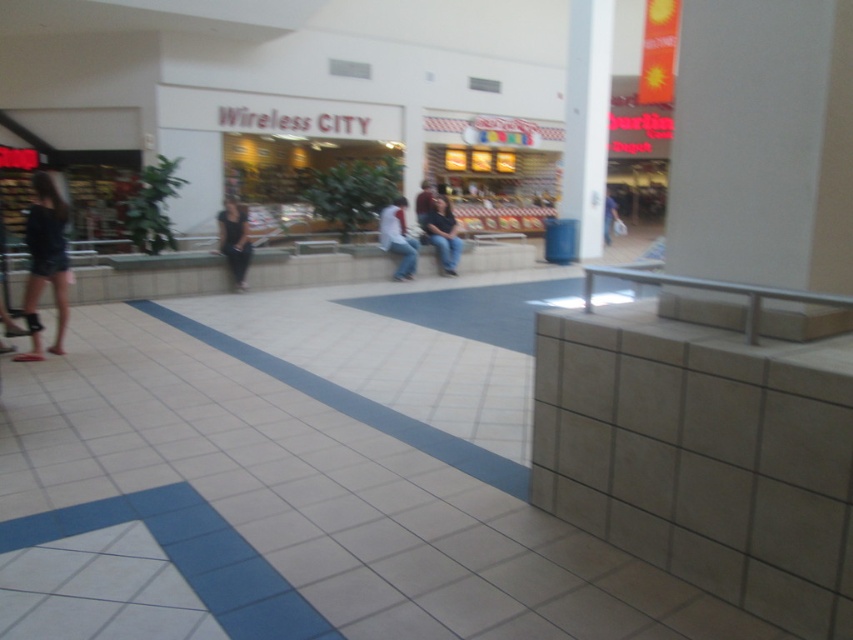
Question: Observing the image, what is the correct spatial positioning of dark gray pants at center in reference to matte white shirt at center?

Choices:
 (A) above
 (B) below

Answer: (B)

Question: Is white glossy pillar at upper center positioned in front of matte black jacket at center?

Choices:
 (A) yes
 (B) no

Answer: (B)

Question: Which point is farther to the camera?

Choices:
 (A) dark blue shorts at left
 (B) matte white shirt at center
 (C) dark blue jeans at center

Answer: (C)

Question: Which of these objects is positioned farthest from the matte white shirt at center?

Choices:
 (A) white glossy pillar at upper center
 (B) matte black jacket at center

Answer: (A)

Question: Which is farther from the dark gray pants at center?

Choices:
 (A) dark blue shorts at left
 (B) matte black jacket at center
 (C) matte white shirt at center

Answer: (A)

Question: Can you confirm if dark blue shorts at left is positioned to the left of matte black jacket at center?

Choices:
 (A) yes
 (B) no

Answer: (A)